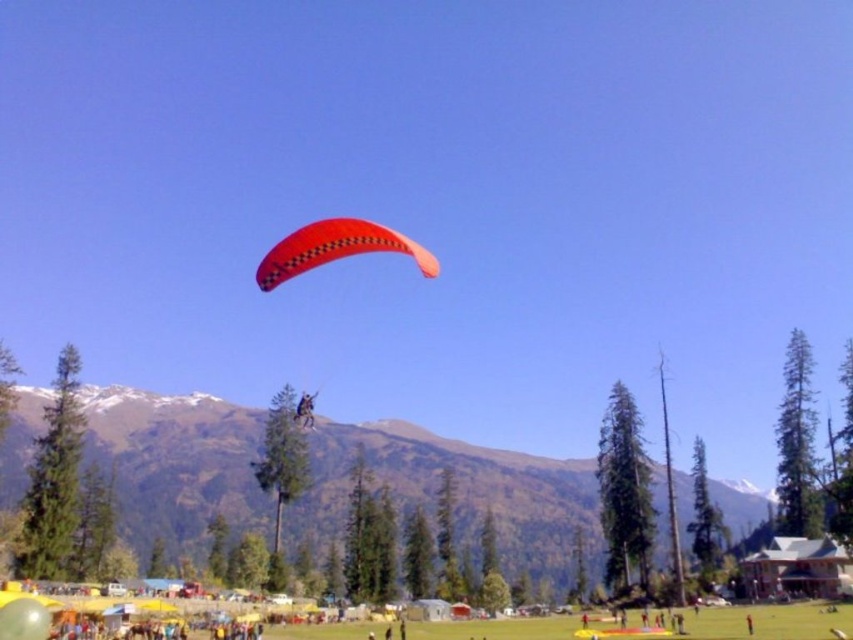
Question: Is snowy rock mountain at upper center to the left of leather jacket at center from the viewer's perspective?

Choices:
 (A) no
 (B) yes

Answer: (A)

Question: Estimate the real-world distances between objects in this image. Which object is closer to the leather jacket at center?

Choices:
 (A) snowy rock mountain at upper center
 (B) matte orange parachute at center
 (C) orange matte parachute at center

Answer: (C)

Question: Which point is closer to the camera taking this photo?

Choices:
 (A) (297, 420)
 (B) (376, 228)
 (C) (532, 456)
 (D) (393, 237)

Answer: (D)

Question: Does orange matte parachute at center lie in front of leather jacket at center?

Choices:
 (A) no
 (B) yes

Answer: (B)

Question: Based on their relative distances, which object is nearer to the orange matte parachute at center?

Choices:
 (A) leather jacket at center
 (B) snowy rock mountain at upper center

Answer: (A)

Question: Does matte orange parachute at center appear over leather jacket at center?

Choices:
 (A) yes
 (B) no

Answer: (A)